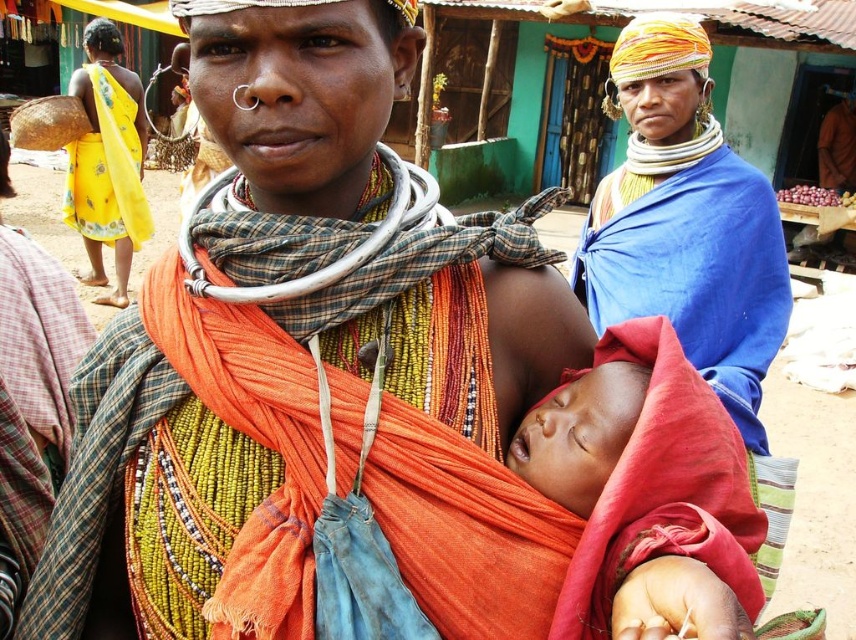
Question: Can you confirm if blue fabric at upper right is positioned above soft red cloth at center?

Choices:
 (A) yes
 (B) no

Answer: (A)

Question: Among these points, which one is nearest to the camera?

Choices:
 (A) (670, 113)
 (B) (654, 467)

Answer: (B)

Question: Can you confirm if blue fabric at upper right is wider than soft red cloth at center?

Choices:
 (A) yes
 (B) no

Answer: (A)

Question: Is blue fabric at upper right closer to the viewer compared to soft red cloth at center?

Choices:
 (A) yes
 (B) no

Answer: (B)